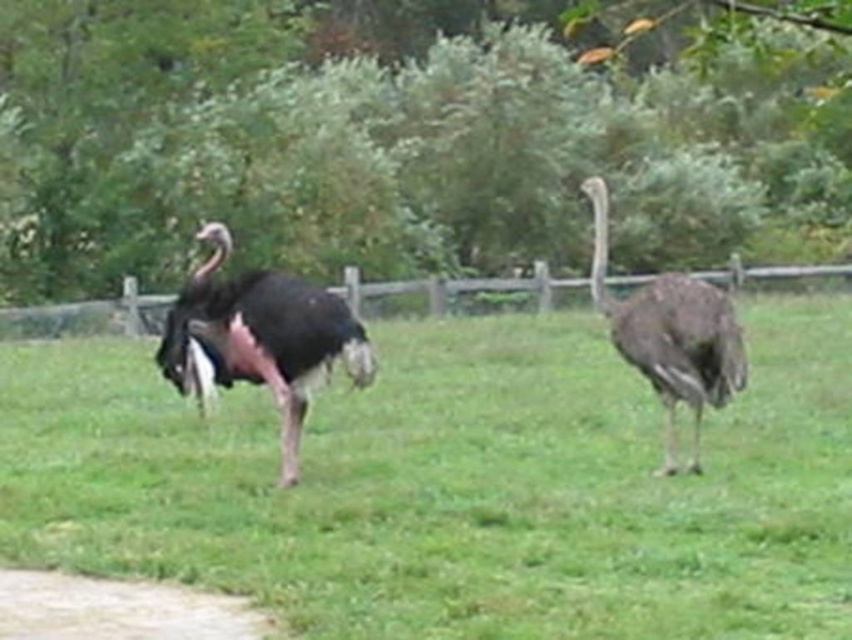
Question: Where is dark brown feathers at left located in relation to dark brown feathers at center in the image?

Choices:
 (A) left
 (B) right

Answer: (A)

Question: Which point appears closest to the camera in this image?

Choices:
 (A) (99, 308)
 (B) (53, 605)
 (C) (366, 374)
 (D) (409, 509)

Answer: (B)

Question: Which of these objects is positioned closest to the dark brown feathers at center?

Choices:
 (A) wooden fence at center
 (B) green grassy at center
 (C) dark brown feathers at left
 (D) dirt path at lower left

Answer: (C)

Question: Does dark brown feathers at left appear on the left side of dark brown feathers at center?

Choices:
 (A) yes
 (B) no

Answer: (A)

Question: Which point is farther from the camera taking this photo?

Choices:
 (A) (285, 394)
 (B) (743, 429)
 (C) (724, 403)

Answer: (B)

Question: Can you confirm if dark brown feathers at left is bigger than dirt path at lower left?

Choices:
 (A) no
 (B) yes

Answer: (B)